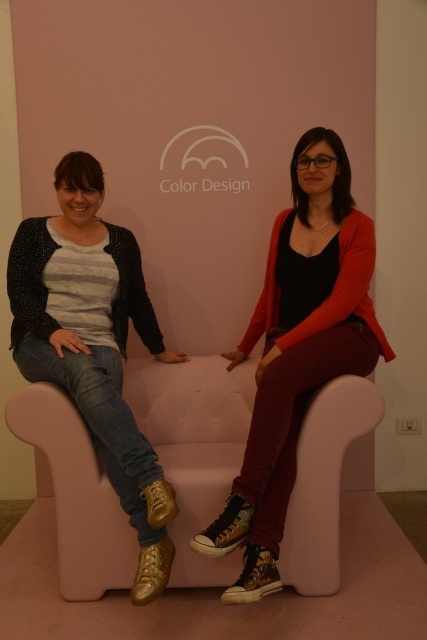
Question: Is pink foam couch at center positioned at the back of denim jeans at left?

Choices:
 (A) no
 (B) yes

Answer: (B)

Question: Based on their relative distances, which object is farther from the denim jeans at left?

Choices:
 (A) pink foam couch at center
 (B) matte black cardigan at center

Answer: (B)

Question: Which of the following is the farthest from the observer?

Choices:
 (A) (64, 460)
 (B) (128, 451)
 (C) (259, 467)

Answer: (A)

Question: Estimate the real-world distances between objects in this image. Which object is closer to the denim jeans at left?

Choices:
 (A) matte black cardigan at center
 (B) pink foam couch at center

Answer: (B)

Question: Is pink foam couch at center above denim jeans at left?

Choices:
 (A) no
 (B) yes

Answer: (A)

Question: Considering the relative positions of pink foam couch at center and denim jeans at left in the image provided, where is pink foam couch at center located with respect to denim jeans at left?

Choices:
 (A) left
 (B) right

Answer: (B)